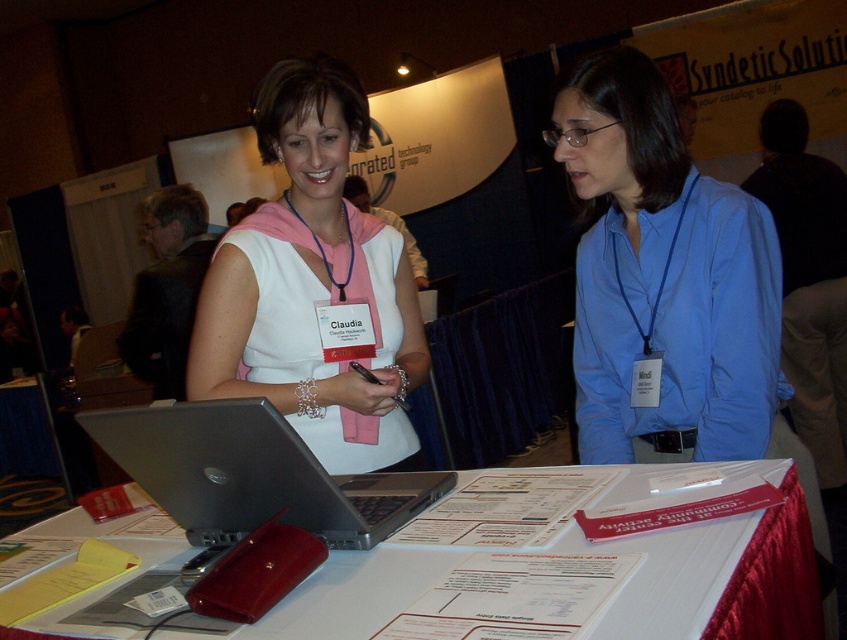
Does point (390, 340) come behind point (216, 470)?

Yes.

Looking at this image, which of these two, white matte vest at center or silver metallic laptop at center, stands shorter?

silver metallic laptop at center

Is point (309, 188) farther from viewer compared to point (358, 500)?

Yes.

The height and width of the screenshot is (640, 847). Identify the location of white matte vest at center. (313, 284).

Can you confirm if blue shirt at center is taller than black suit jacket at left?

→ Incorrect, blue shirt at center's height is not larger of black suit jacket at left's.

Between point (657, 124) and point (178, 362), which one is positioned in front?

Positioned in front is point (657, 124).

Where is `blue shirt at center`? This screenshot has width=847, height=640. blue shirt at center is located at coordinates pyautogui.click(x=663, y=276).

Between silver metallic laptop at center and black suit jacket at left, which one is positioned higher?

black suit jacket at left

Can you confirm if silver metallic laptop at center is positioned to the left of black suit jacket at left?

Incorrect, silver metallic laptop at center is not on the left side of black suit jacket at left.

Is point (424, 500) positioned in front of point (145, 200)?

Yes.

You are a GUI agent. You are given a task and a screenshot of the screen. Output one action in this format:
    pyautogui.click(x=<x>, y=<y>)
    Task: Click on the silver metallic laptop at center
    The image size is (847, 640).
    Given the screenshot: What is the action you would take?
    pyautogui.click(x=252, y=474)